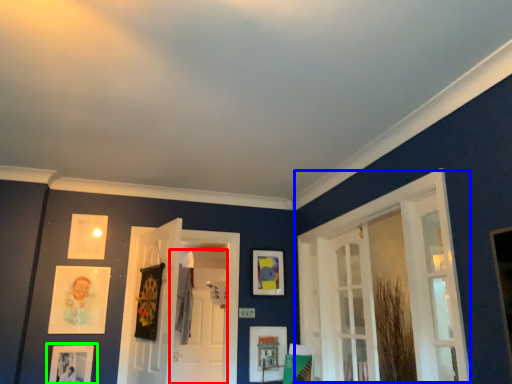
Question: Which object is positioned closest to screen door (highlighted by a red box)? Select from window (highlighted by a blue box) and picture frame (highlighted by a green box).

Choices:
 (A) window
 (B) picture frame

Answer: (B)